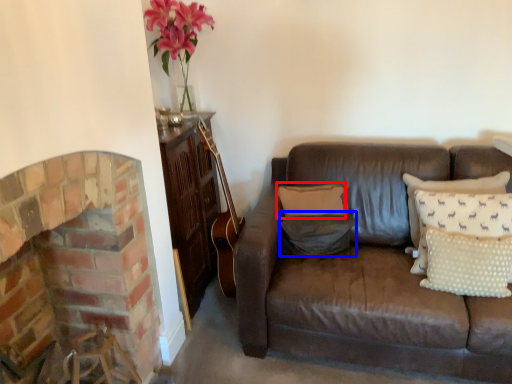
Question: Which object is further to the camera taking this photo, pillow (highlighted by a red box) or pillow (highlighted by a blue box)?

Choices:
 (A) pillow
 (B) pillow

Answer: (A)